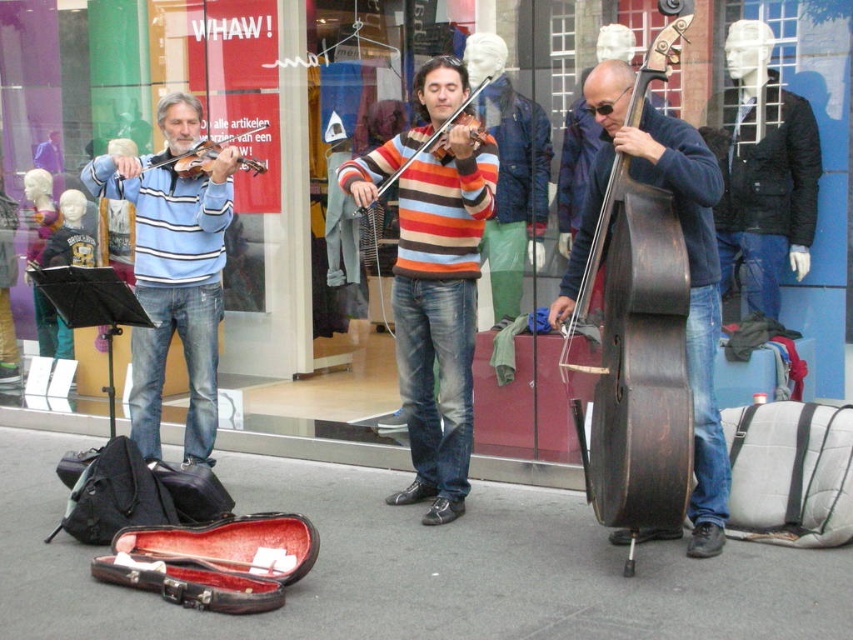
Is point (621, 106) closer to viewer compared to point (184, 152)?

Yes.

How much distance is there between dark brown polished wood cello at right and matte black violin at left?

dark brown polished wood cello at right and matte black violin at left are 6.94 feet apart.

Locate an element on the screen. The width and height of the screenshot is (853, 640). dark brown polished wood cello at right is located at coordinates (666, 237).

The image size is (853, 640). What do you see at coordinates (440, 307) in the screenshot?
I see `striped sweater at center` at bounding box center [440, 307].

The height and width of the screenshot is (640, 853). I want to click on striped sweater at center, so click(440, 307).

Which is behind, point (447, 90) or point (469, 96)?

The point (469, 96) is behind.

What do you see at coordinates (440, 307) in the screenshot? I see `striped sweater at center` at bounding box center [440, 307].

Does point (440, 352) come behind point (445, 116)?

Yes, point (440, 352) is farther from viewer.

At what (x,y) coordinates should I click in order to perform the action: click on striped sweater at center. Please return your answer as a coordinate pair (x, y). This screenshot has width=853, height=640. Looking at the image, I should click on (440, 307).